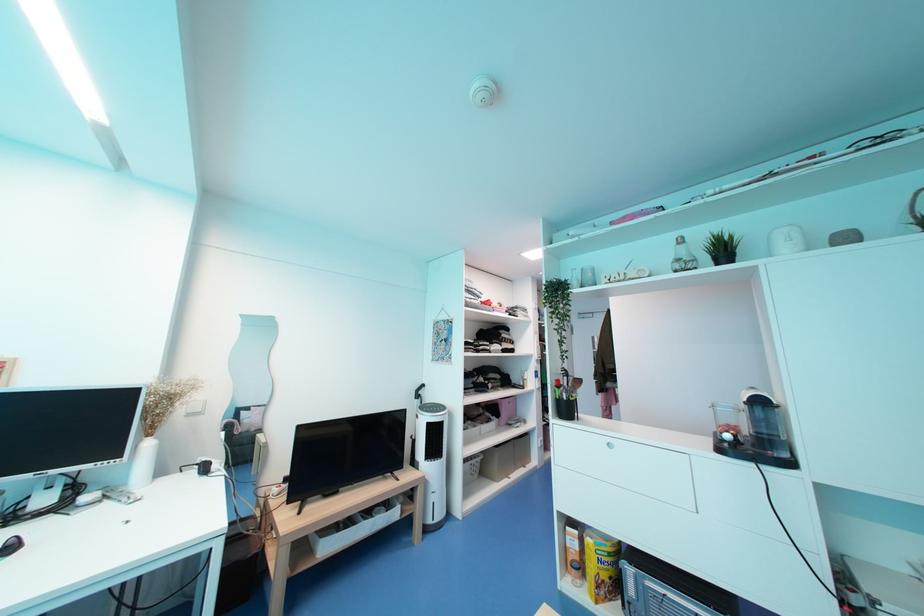
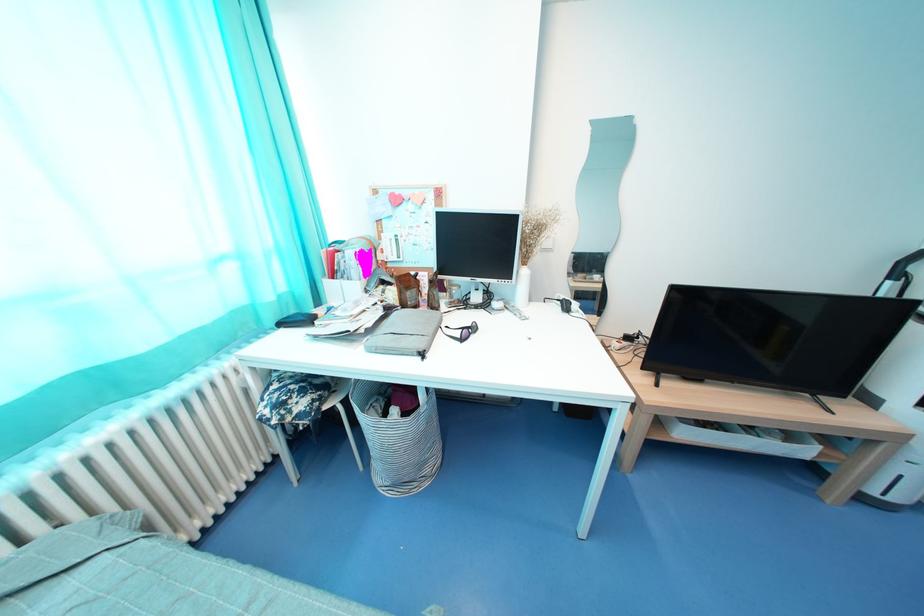
How did the camera likely rotate?

The rotation direction of the camera is left-down.